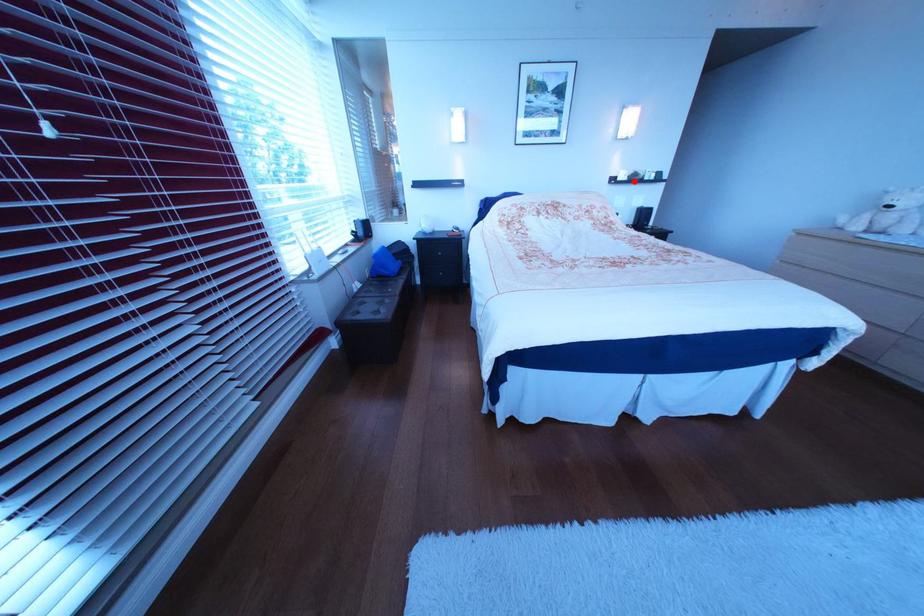
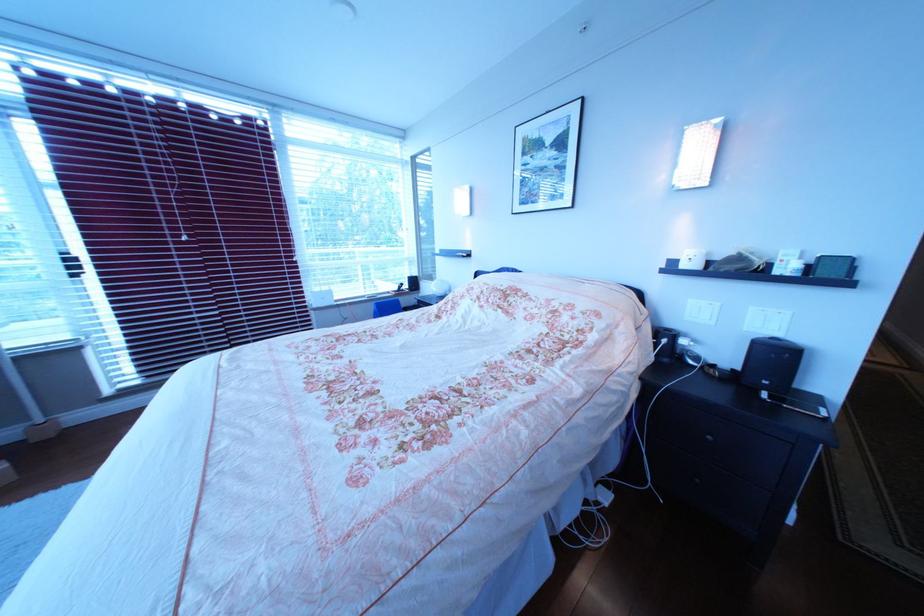
Find the pixel in the second image that matches the highlighted location in the first image.

(699, 267)